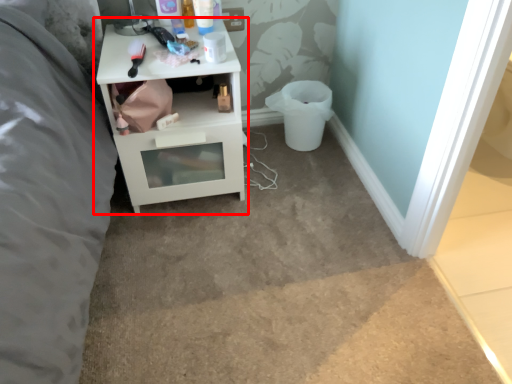
Question: From the image's perspective, what is the correct spatial relationship of nightstand (annotated by the red box) in relation to toilet bowl?

Choices:
 (A) below
 (B) above

Answer: (A)